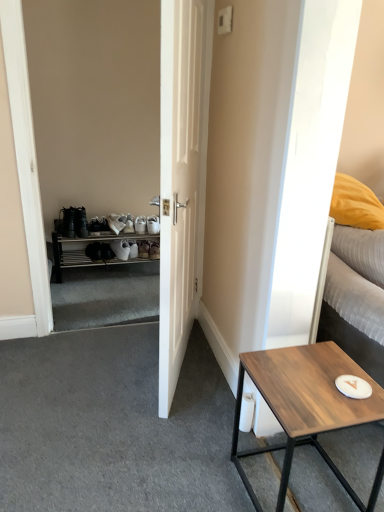
Question: Is point (374, 272) positioned closer to the camera than point (264, 378)?

Choices:
 (A) farther
 (B) closer

Answer: (A)

Question: Considering the positions of white textured bed at right and wooden table at lower right in the image, is white textured bed at right taller or shorter than wooden table at lower right?

Choices:
 (A) short
 (B) tall

Answer: (A)

Question: Which object is the farthest from the white matte door at center?

Choices:
 (A) wooden table at lower right
 (B) white plastic shoe rack at left
 (C) white textured bed at right

Answer: (B)

Question: Which of these objects is positioned closest to the white plastic shoe rack at left?

Choices:
 (A) white textured bed at right
 (B) wooden table at lower right
 (C) white matte door at center

Answer: (C)